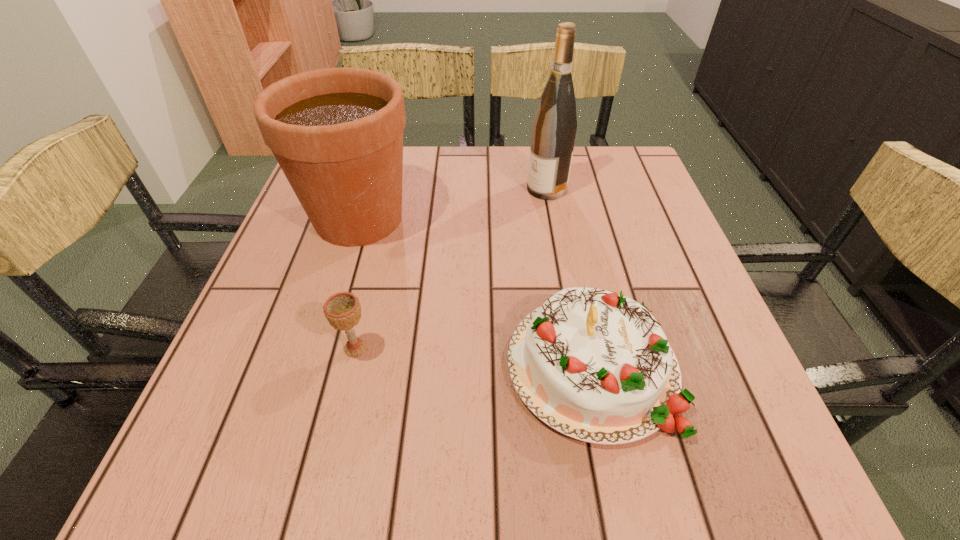
This screenshot has height=540, width=960. I want to click on unoccupied area between the third shortest object and the shortest object, so click(x=357, y=284).

At what (x,y) coordinates should I click in order to perform the action: click on object that is the third nearest to the shortest object. Please return your answer as a coordinate pair (x, y). Looking at the image, I should click on [554, 126].

At what (x,y) coordinates should I click in order to perform the action: click on object that stands as the second closest to the flowerpot. Please return your answer as a coordinate pair (x, y). Looking at the image, I should click on (595, 365).

Locate an element on the screen. This screenshot has width=960, height=540. vacant space that satisfies the following two spatial constraints: 1. on the back side of the shortest object; 2. on the right side of the wine bottle is located at coordinates (394, 188).